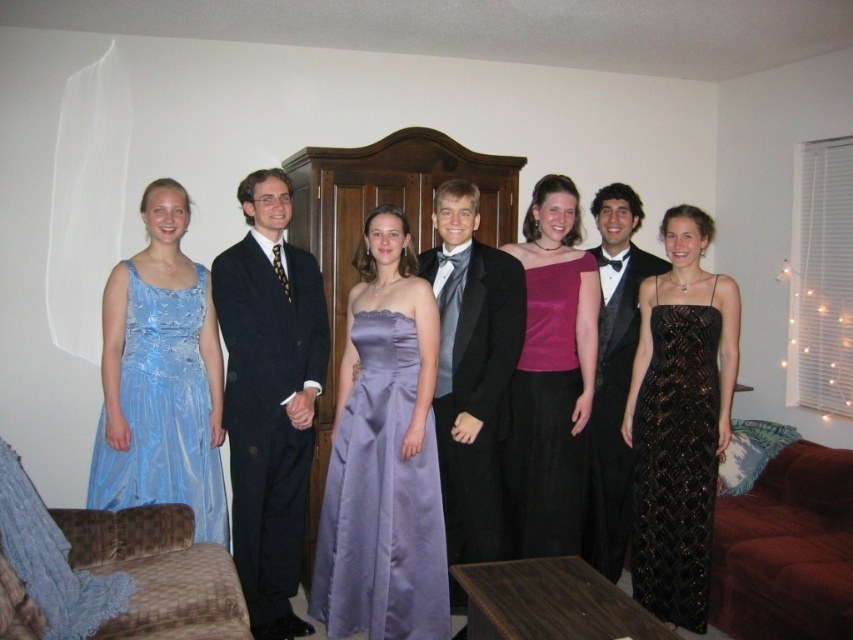
Question: In this image, where is shiny blue dress at left located relative to black satin tuxedo at center?

Choices:
 (A) right
 (B) left

Answer: (B)

Question: Can you confirm if purple satin dress at center is positioned above shiny blue dress at left?

Choices:
 (A) yes
 (B) no

Answer: (A)

Question: Which point appears closest to the camera in this image?

Choices:
 (A) (598, 556)
 (B) (550, 416)
 (C) (392, 612)

Answer: (C)

Question: Which point is closer to the camera?

Choices:
 (A) purple satin dress at center
 (B) black satin suit at center
 (C) silky satin dress at center

Answer: (A)

Question: Does satin dress at center come behind purple satin dress at center?

Choices:
 (A) yes
 (B) no

Answer: (B)

Question: Which object appears closest to the camera in this image?

Choices:
 (A) black sequined dress at center
 (B) satin dress at center
 (C) black satin suit at center
 (D) silky satin dress at center

Answer: (B)